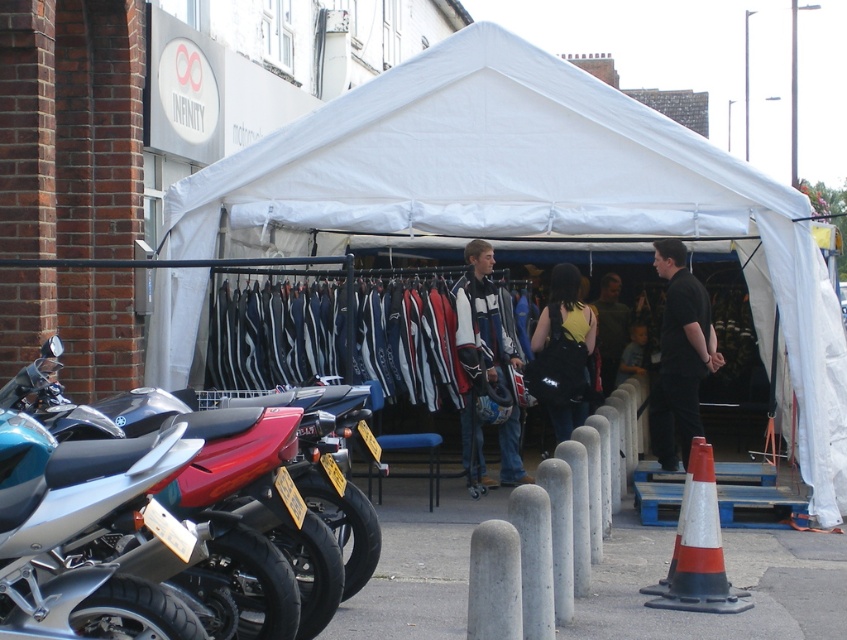
Question: Estimate the real-world distances between objects in this image. Which object is closer to the orange and white plastic traffic cone at lower right?

Choices:
 (A) black matte shirt at center
 (B) silver metallic motorcycle at left
 (C) white leather jacket at center

Answer: (B)

Question: Is white fabric tent at center positioned before light blue denim jacket at center?

Choices:
 (A) no
 (B) yes

Answer: (B)

Question: Which point is farther to the camera?

Choices:
 (A) (490, 248)
 (B) (602, 342)
 (C) (261, 540)

Answer: (B)

Question: Where is black fabric backpack at center located in relation to dark green jacket at center in the image?

Choices:
 (A) left
 (B) right

Answer: (A)

Question: Which is farther from the dark green jacket at center?

Choices:
 (A) black fabric backpack at center
 (B) black matte shirt at center
 (C) orange and white plastic traffic cone at lower right

Answer: (C)

Question: Considering the relative positions of black fabric backpack at center and dark green jacket at center in the image provided, where is black fabric backpack at center located with respect to dark green jacket at center?

Choices:
 (A) below
 (B) above

Answer: (A)